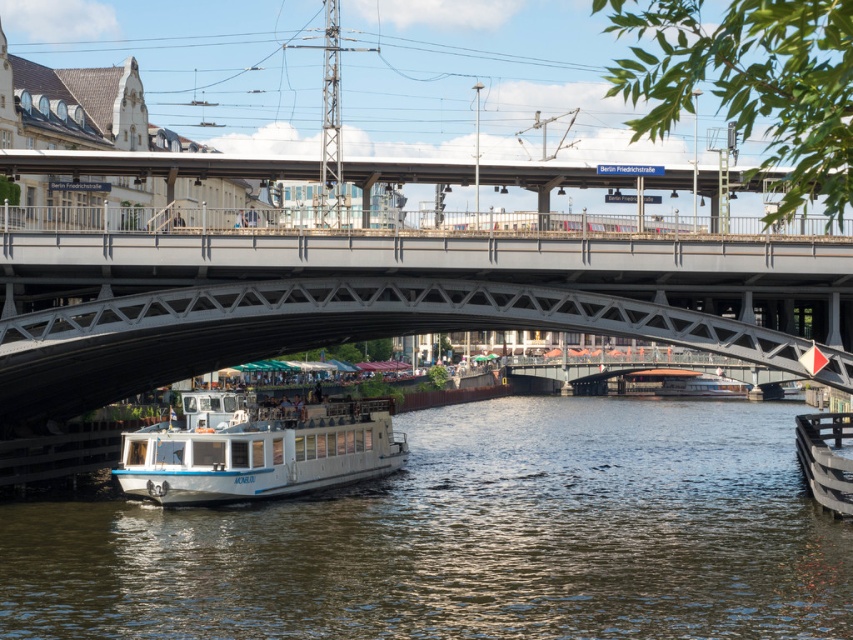
Is white glossy boat at lower center thinner than white glossy boat at center?

Yes, white glossy boat at lower center is thinner than white glossy boat at center.

Does white glossy boat at lower center appear on the left side of white glossy boat at center?

Correct, you'll find white glossy boat at lower center to the left of white glossy boat at center.

Which is in front, point (202, 467) or point (744, 390)?

Point (202, 467) is in front.

Locate an element on the screen. white glossy boat at lower center is located at coordinates (257, 449).

Who is positioned more to the right, white glossy water at center or metallic gray bridge at center?

white glossy water at center is more to the right.

Which is in front, point (152, 616) or point (840, 369)?

Point (152, 616) is in front.

Between point (305, 508) and point (32, 289), which one is positioned in front?

Point (32, 289) is in front.

At what (x,y) coordinates should I click in order to perform the action: click on white glossy water at center. Please return your answer as a coordinate pair (x, y). Image resolution: width=853 pixels, height=640 pixels. Looking at the image, I should click on (469, 538).

Who is lower down, metallic gray bridge at center or white glossy boat at center?

white glossy boat at center

Measure the distance between metallic gray bridge at center and camera.

They are 74.36 meters apart.

The width and height of the screenshot is (853, 640). I want to click on metallic gray bridge at center, so click(374, 298).